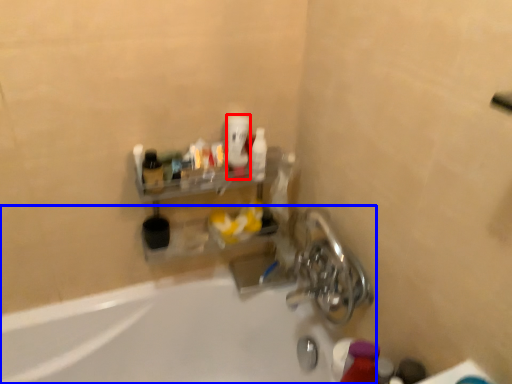
Question: Among these objects, which one is farthest to the camera, mouthwash (highlighted by a red box) or bathtub (highlighted by a blue box)?

Choices:
 (A) mouthwash
 (B) bathtub

Answer: (A)